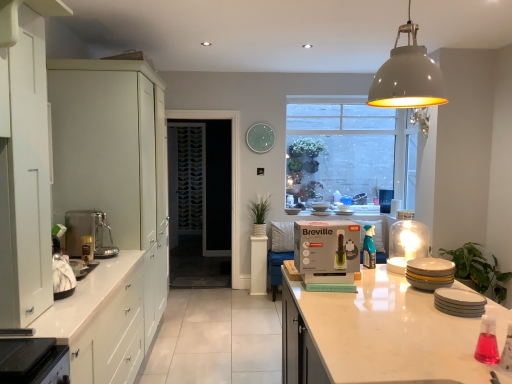
Locate an element on the screen. The height and width of the screenshot is (384, 512). vacant area located to the right-hand side of white matte cabinet at left, placed as the 1th cabinetry when sorted from front to back is located at coordinates (65, 313).